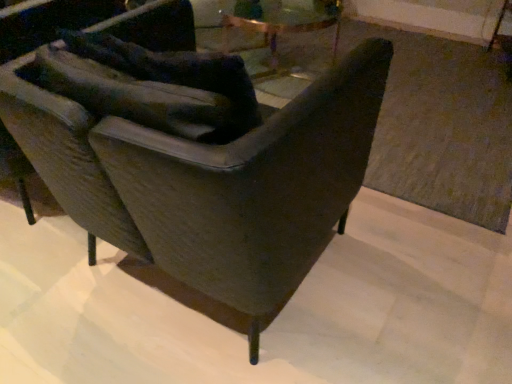
Find the location of a particular element. This screenshot has height=384, width=512. matte gray chair at left is located at coordinates click(x=48, y=24).

Image resolution: width=512 pixels, height=384 pixels. Describe the element at coordinates (48, 24) in the screenshot. I see `matte gray chair at left` at that location.

What do you see at coordinates (252, 187) in the screenshot?
I see `dark gray leather rocking chair at center` at bounding box center [252, 187].

The width and height of the screenshot is (512, 384). Identify the location of dark gray leather rocking chair at center. (252, 187).

Where is `matte gray chair at left`? This screenshot has height=384, width=512. matte gray chair at left is located at coordinates (48, 24).

Considering the positions of objects matte gray chair at left and dark gray leather rocking chair at center in the image provided, who is more to the right, matte gray chair at left or dark gray leather rocking chair at center?

dark gray leather rocking chair at center.

Which is in front, matte gray chair at left or dark gray leather rocking chair at center?

dark gray leather rocking chair at center.

Does point (95, 19) come in front of point (282, 236)?

No.

From the image's perspective, is matte gray chair at left below dark gray leather rocking chair at center?

No.

From a real-world perspective, is matte gray chair at left beneath dark gray leather rocking chair at center?

Yes, from a real-world perspective, matte gray chair at left is below dark gray leather rocking chair at center.

Can you confirm if matte gray chair at left is wider than dark gray leather rocking chair at center?

No, matte gray chair at left is not wider than dark gray leather rocking chair at center.

Which of these two, matte gray chair at left or dark gray leather rocking chair at center, stands taller?

matte gray chair at left.

Considering the relative sizes of matte gray chair at left and dark gray leather rocking chair at center in the image provided, is matte gray chair at left bigger than dark gray leather rocking chair at center?

No, matte gray chair at left is not bigger than dark gray leather rocking chair at center.

Is matte gray chair at left situated inside dark gray leather rocking chair at center or outside?

matte gray chair at left lies outside dark gray leather rocking chair at center.

Is there a large distance between matte gray chair at left and dark gray leather rocking chair at center?

matte gray chair at left is near dark gray leather rocking chair at center, not far away.

Is matte gray chair at left positioned with its back to dark gray leather rocking chair at center?

No.

Measure the distance from matte gray chair at left to dark gray leather rocking chair at center.

The distance of matte gray chair at left from dark gray leather rocking chair at center is 58.01 centimeters.

The height and width of the screenshot is (384, 512). What are the coordinates of `rocking chair in front of the matte gray chair at left` in the screenshot? It's located at (252, 187).

In the scene shown: Considering the positions of objects dark gray leather rocking chair at center and matte gray chair at left in the image provided, who is more to the left, dark gray leather rocking chair at center or matte gray chair at left?

Positioned to the left is matte gray chair at left.

Which is in front, dark gray leather rocking chair at center or matte gray chair at left?

dark gray leather rocking chair at center is closer to the camera.

Is point (278, 160) less distant than point (144, 20)?

Yes, point (278, 160) is in front of point (144, 20).

From the image's perspective, relative to matte gray chair at left, is dark gray leather rocking chair at center above or below?

dark gray leather rocking chair at center is below matte gray chair at left.

From a real-world perspective, is dark gray leather rocking chair at center positioned over matte gray chair at left based on gravity?

Yes, from a real-world perspective, dark gray leather rocking chair at center is over matte gray chair at left

Considering the sizes of dark gray leather rocking chair at center and matte gray chair at left in the image, is dark gray leather rocking chair at center wider or thinner than matte gray chair at left?

Clearly, dark gray leather rocking chair at center has more width compared to matte gray chair at left.

Does dark gray leather rocking chair at center have a greater height compared to matte gray chair at left?

No, dark gray leather rocking chair at center is not taller than matte gray chair at left.

Considering the relative sizes of dark gray leather rocking chair at center and matte gray chair at left in the image provided, is dark gray leather rocking chair at center smaller than matte gray chair at left?

No.

Is dark gray leather rocking chair at center outside of matte gray chair at left?

Yes, dark gray leather rocking chair at center is not within matte gray chair at left.

Is dark gray leather rocking chair at center not close to matte gray chair at left?

That's not correct — dark gray leather rocking chair at center is a little close to matte gray chair at left.

Is dark gray leather rocking chair at center facing towards matte gray chair at left?

No.

You are a GUI agent. You are given a task and a screenshot of the screen. Output one action in this format:
    pyautogui.click(x=<x>, y=<y>)
    Task: Click on the rocking chair that appears below the matte gray chair at left (from the image's perspective)
    The height and width of the screenshot is (384, 512).
    Given the screenshot: What is the action you would take?
    pyautogui.click(x=252, y=187)

The width and height of the screenshot is (512, 384). I want to click on rocking chair lying on the right of matte gray chair at left, so click(252, 187).

Find the location of a particular element. This screenshot has height=384, width=512. chair that is on the left side of dark gray leather rocking chair at center is located at coordinates (48, 24).